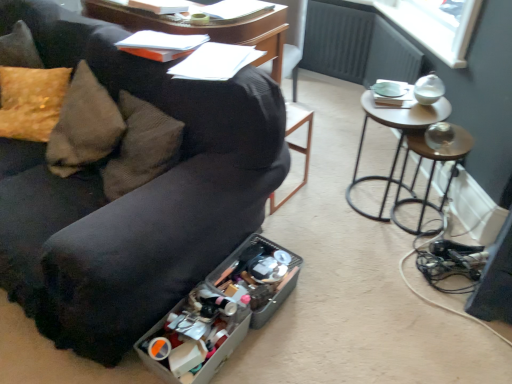
Question: In the image, is metallic brown stool at right positioned in front of or behind black leather bar stool at center?

Choices:
 (A) front
 (B) behind

Answer: (B)

Question: From a real-world perspective, is metallic brown stool at right physically located above or below black leather bar stool at center?

Choices:
 (A) above
 (B) below

Answer: (B)

Question: Estimate the real-world distances between objects in this image. Which object is closer to the translucent plastic container at lower center, positioned as the second storage box in front-to-back order?

Choices:
 (A) metallic silver table at right
 (B) metallic brown stool at right
 (C) black leather bar stool at center
 (D) translucent plastic storage box at lower center, arranged as the second storage box when viewed from the back
 (E) black fabric couch at lower left

Answer: (D)

Question: Estimate the real-world distances between objects in this image. Which object is farther from the metallic brown stool at right?

Choices:
 (A) metallic silver table at right
 (B) translucent plastic container at lower center, positioned as the second storage box in front-to-back order
 (C) black leather bar stool at center
 (D) black fabric couch at lower left
 (E) translucent plastic storage box at lower center, the first storage box positioned from the front

Answer: (E)